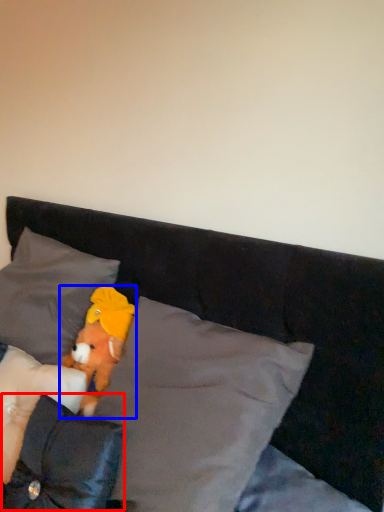
Question: Among these objects, which one is farthest to the camera, pillow (highlighted by a red box) or teddy bear (highlighted by a blue box)?

Choices:
 (A) pillow
 (B) teddy bear

Answer: (B)